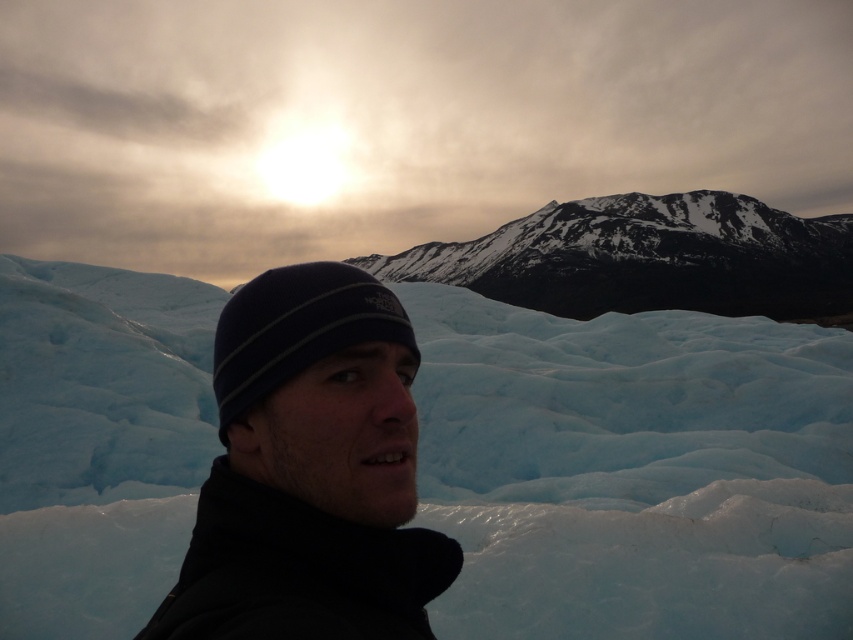
Consider the image. You are a photographer planning to capture a landscape photo that includes both the black knit cap at center and the snowy rocky mountain at center. Given their relative sizes, which object should you focus on to ensure both are clearly visible in the frame?

The black knit cap at center has a lesser width compared to the snowy rocky mountain at center, so focusing on the snowy rocky mountain at center would allow both objects to be clearly visible in the frame.

Based on the photo, you are a photographer wanting to capture the snowy rocky mountain at center in your shot. However, the black knit cap at center is blocking your view. Can you move the cap to the side so that the mountain becomes visible?

The black knit cap at center is below the snowy rocky mountain at center, so moving the cap to the side would allow the mountain to become visible as it is positioned above the cap.